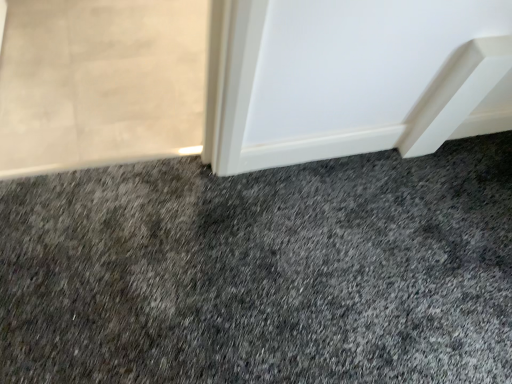
Question: Is translucent glass screen door at upper left outside of dark gray carpet at center?

Choices:
 (A) no
 (B) yes

Answer: (B)

Question: Is translucent glass screen door at upper left touching dark gray carpet at center?

Choices:
 (A) no
 (B) yes

Answer: (A)

Question: From a real-world perspective, is translucent glass screen door at upper left located beneath dark gray carpet at center?

Choices:
 (A) no
 (B) yes

Answer: (B)

Question: Considering the relative sizes of translucent glass screen door at upper left and dark gray carpet at center in the image provided, is translucent glass screen door at upper left taller than dark gray carpet at center?

Choices:
 (A) no
 (B) yes

Answer: (B)

Question: Is translucent glass screen door at upper left bigger than dark gray carpet at center?

Choices:
 (A) yes
 (B) no

Answer: (B)

Question: From the image's perspective, is translucent glass screen door at upper left located above dark gray carpet at center?

Choices:
 (A) yes
 (B) no

Answer: (A)

Question: Is dark gray carpet at center placed right next to translucent glass screen door at upper left?

Choices:
 (A) no
 (B) yes

Answer: (A)

Question: From a real-world perspective, is dark gray carpet at center below translucent glass screen door at upper left?

Choices:
 (A) no
 (B) yes

Answer: (A)

Question: From the image's perspective, is dark gray carpet at center on top of translucent glass screen door at upper left?

Choices:
 (A) no
 (B) yes

Answer: (A)

Question: From the image's perspective, is dark gray carpet at center beneath translucent glass screen door at upper left?

Choices:
 (A) yes
 (B) no

Answer: (A)

Question: Does dark gray carpet at center have a lesser width compared to translucent glass screen door at upper left?

Choices:
 (A) yes
 (B) no

Answer: (B)

Question: Could you tell me if dark gray carpet at center is facing translucent glass screen door at upper left?

Choices:
 (A) no
 (B) yes

Answer: (B)

Question: Is translucent glass screen door at upper left inside or outside of dark gray carpet at center?

Choices:
 (A) inside
 (B) outside

Answer: (B)